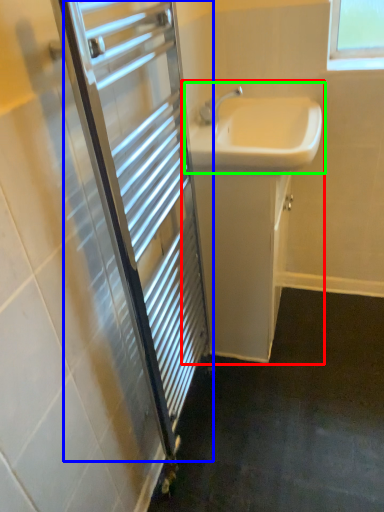
Question: Based on their relative distances, which object is nearer to bathroom cabinet (highlighted by a red box)? Choose from screen door (highlighted by a blue box) and sink (highlighted by a green box).

Choices:
 (A) screen door
 (B) sink

Answer: (B)